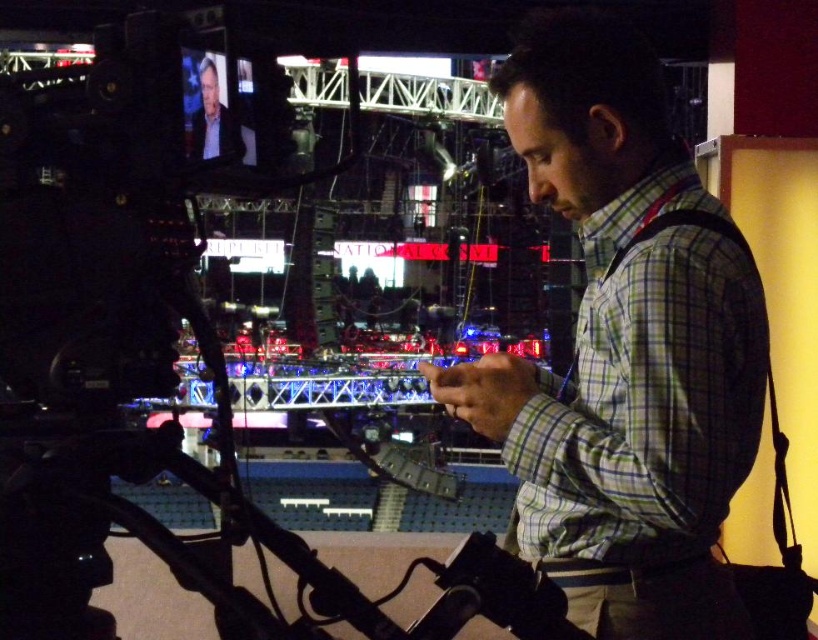
Does green checkered shirt at center lie behind light gray suit at upper left?

Yes, it is behind light gray suit at upper left.

Can you confirm if green checkered shirt at center is wider than light gray suit at upper left?

Yes, green checkered shirt at center is wider than light gray suit at upper left.

Locate an element on the screen. green checkered shirt at center is located at coordinates (623, 349).